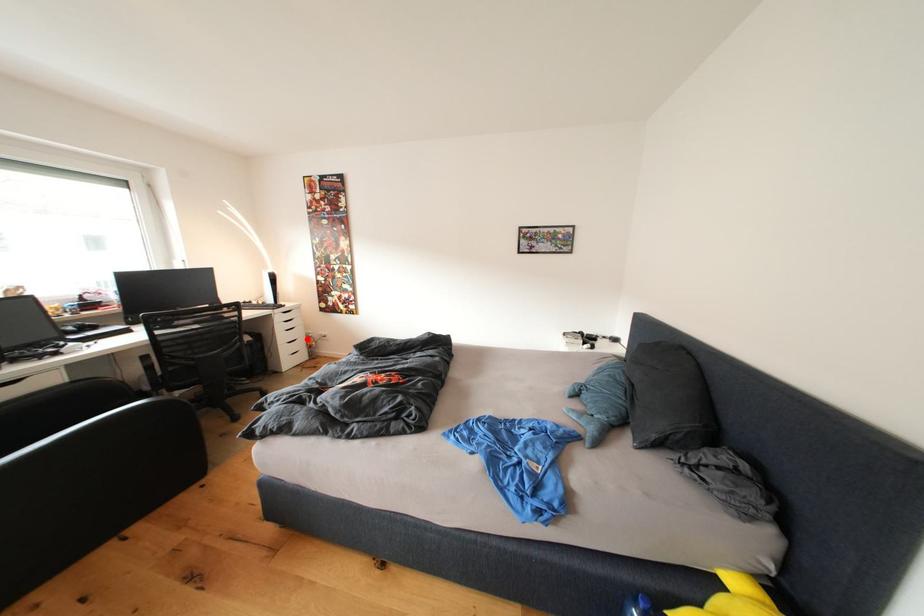
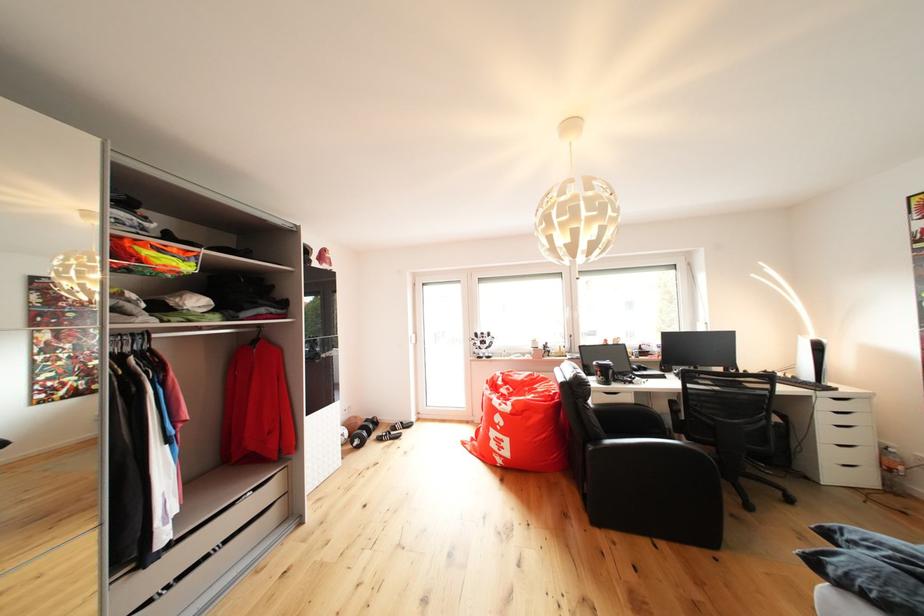
In the second image, find the point that corresponds to the highlighted location in the first image.

(869, 444)